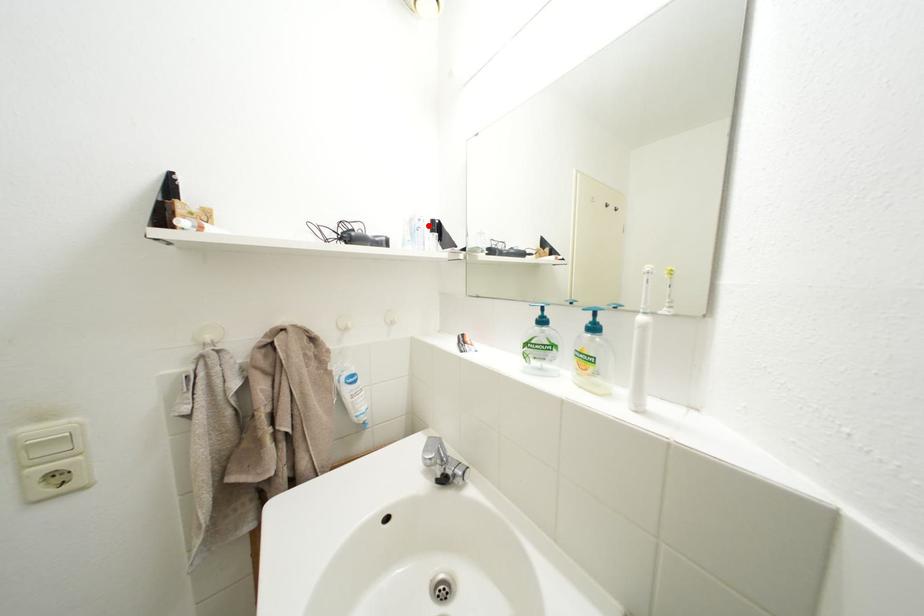
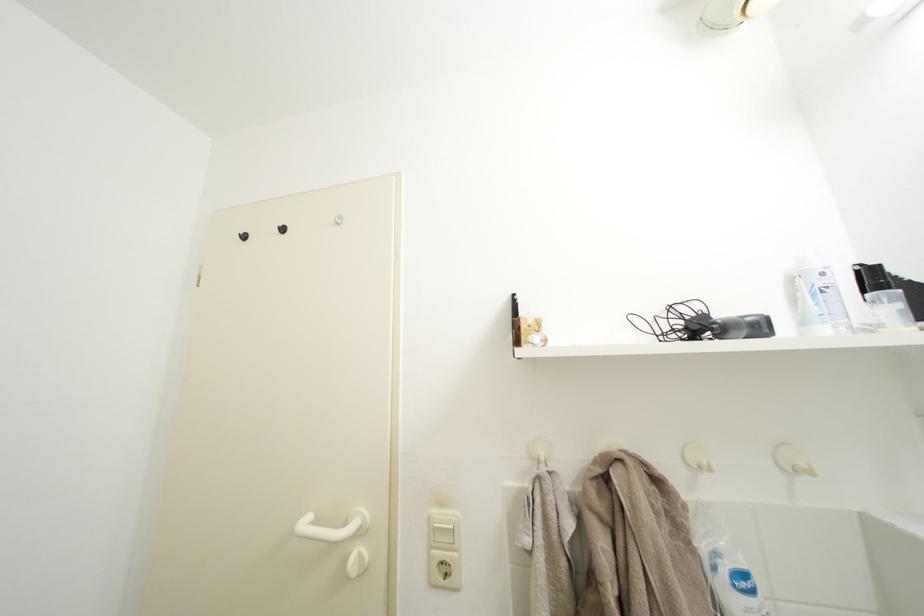
Where in the second image is the point corresponding to the highlighted location from the first image?

(833, 280)